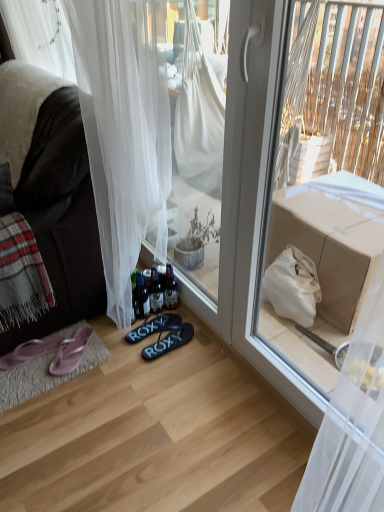
Question: Looking at the image, does plaid woolen blanket at left seem bigger or smaller compared to translucent glass bottles at lower center, which appears as the 2th bottle when viewed from the right?

Choices:
 (A) big
 (B) small

Answer: (A)

Question: Is plaid woolen blanket at left situated inside translucent glass bottles at lower center, which appears as the 2th bottle when viewed from the right, or outside?

Choices:
 (A) inside
 (B) outside

Answer: (B)

Question: Which of these objects is positioned closest to the pink fabric flip-flops at lower left, arranged as the third footwear when viewed from the right?

Choices:
 (A) pink fabric flip-flops at lower left, arranged as the fourth footwear when viewed from the right
 (B) translucent glass bottle at lower center, marked as the 1th bottle in a right-to-left arrangement
 (C) translucent glass bottles at lower center, which appears as the 2th bottle when viewed from the right
 (D) dark brown leather couch at left
 (E) matte cardboard box at upper right

Answer: (A)

Question: Estimate the real-world distances between objects in this image. Which object is closer to the matte cardboard box at upper right?

Choices:
 (A) white sheer curtain at lower left
 (B) pink fabric flip-flops at lower left, arranged as the third footwear when viewed from the right
 (C) translucent glass bottles at lower center, which is the 1th bottle in left-to-right order
 (D) black rubber flip-flops at center, the 2th footwear when ordered from right to left
 (E) dark brown leather couch at left

Answer: (A)